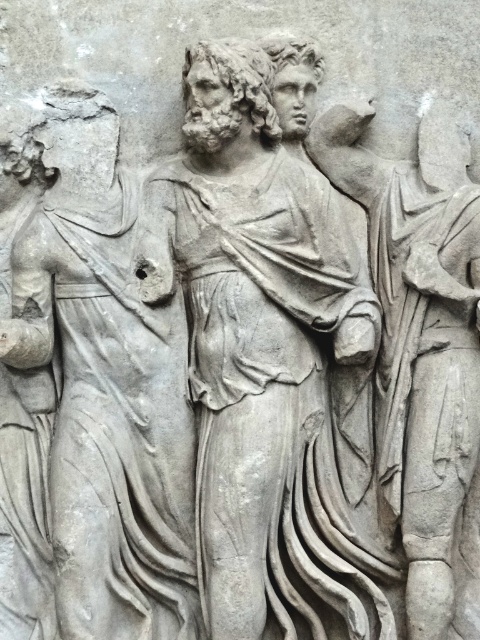
Based on the scene description, which object is taller between the gray stone statue at center and the gray stone figure at left?

The gray stone statue at center is taller than the gray stone figure at left.